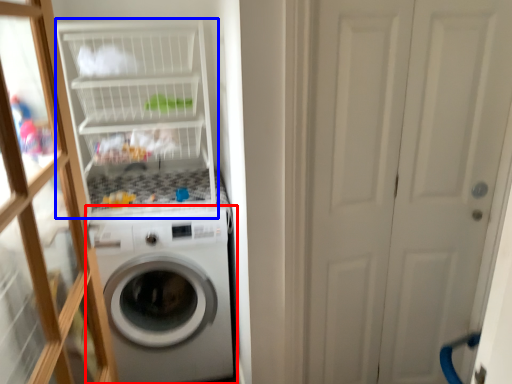
Question: Among these objects, which one is nearest to the camera, washing machine (highlighted by a red box) or shelf (highlighted by a blue box)?

Choices:
 (A) washing machine
 (B) shelf

Answer: (B)